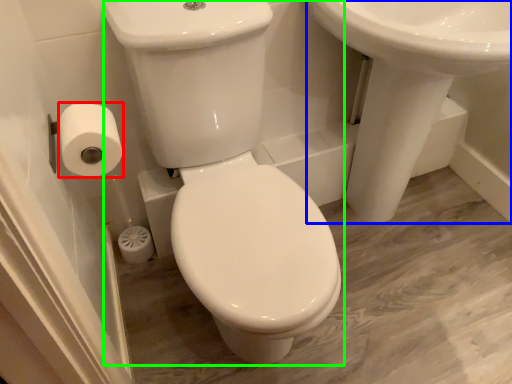
Question: Considering the real-world distances, which object is closest to toilet paper (highlighted by a red box)? sink (highlighted by a blue box) or porcelain (highlighted by a green box).

Choices:
 (A) sink
 (B) porcelain

Answer: (B)